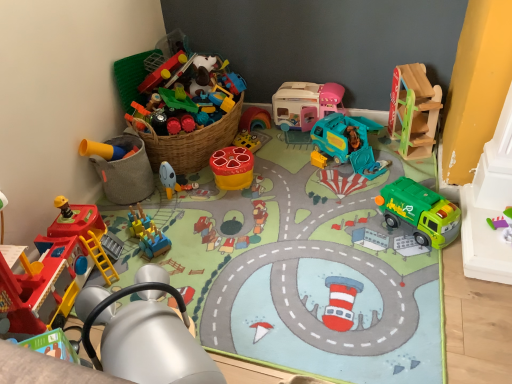
I want to click on free space that is in between teal plastic garbage truck at center, acting as the 7th toy starting from the left, and matte plastic toy at center, which is the 3th toy in left-to-right order, so click(267, 175).